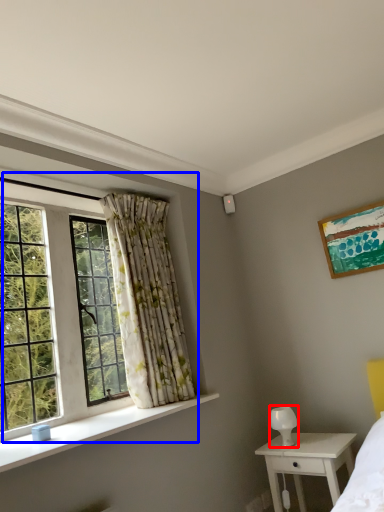
Question: Which object is closer to the camera taking this photo, lamp (highlighted by a red box) or window (highlighted by a blue box)?

Choices:
 (A) lamp
 (B) window

Answer: (B)